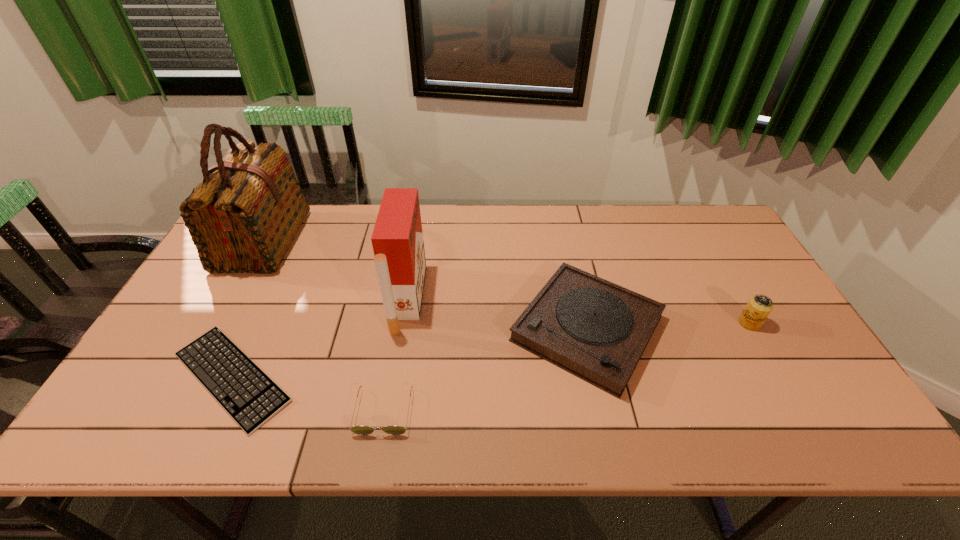
Locate an element on the screen. The width and height of the screenshot is (960, 540). free spot between the tallest object and the shortest object is located at coordinates (248, 309).

This screenshot has width=960, height=540. Identify the location of vacant area that lies between the third tallest object and the computer keyboard. (491, 350).

Locate an element on the screen. This screenshot has height=540, width=960. object that stands as the fifth closest to the shortest object is located at coordinates (759, 307).

Identify which object is the closest to the second object from right to left. Please provide its 2D coordinates. Your answer should be formatted as a tuple, i.e. [(x, y)], where the tuple contains the x and y coordinates of a point satisfying the conditions above.

[(759, 307)]

Locate an element on the screen. free region that satisfies the following two spatial constraints: 1. on the front-facing side of the fifth shortest object; 2. on the left side of the rightmost object is located at coordinates (403, 323).

Where is `free spot that satisfies the following two spatial constraints: 1. on the back side of the third tallest object; 2. on the front-facing side of the second tallest object`? free spot that satisfies the following two spatial constraints: 1. on the back side of the third tallest object; 2. on the front-facing side of the second tallest object is located at coordinates (735, 299).

Find the location of a particular element. The width and height of the screenshot is (960, 540). free space that satisfies the following two spatial constraints: 1. on the open handle side of the tallest object; 2. on the back side of the shortest object is located at coordinates (188, 377).

Identify the location of vacant space that satisfies the following two spatial constraints: 1. on the front-facing side of the fifth shortest object; 2. on the left side of the second object from right to left. The image size is (960, 540). (402, 329).

Locate an element on the screen. The image size is (960, 540). free location that satisfies the following two spatial constraints: 1. on the back side of the second object from right to left; 2. on the open handle side of the shopping bag is located at coordinates (567, 242).

The image size is (960, 540). I want to click on free location that satisfies the following two spatial constraints: 1. on the back side of the fourth shortest object; 2. on the right side of the shortest object, so (257, 323).